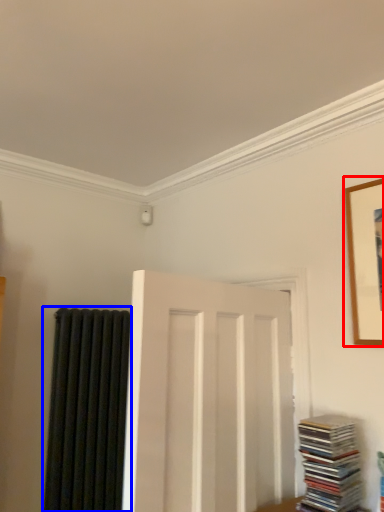
Question: Which of the following is the farthest to the observer, picture frame (highlighted by a red box) or curtain (highlighted by a blue box)?

Choices:
 (A) picture frame
 (B) curtain

Answer: (B)